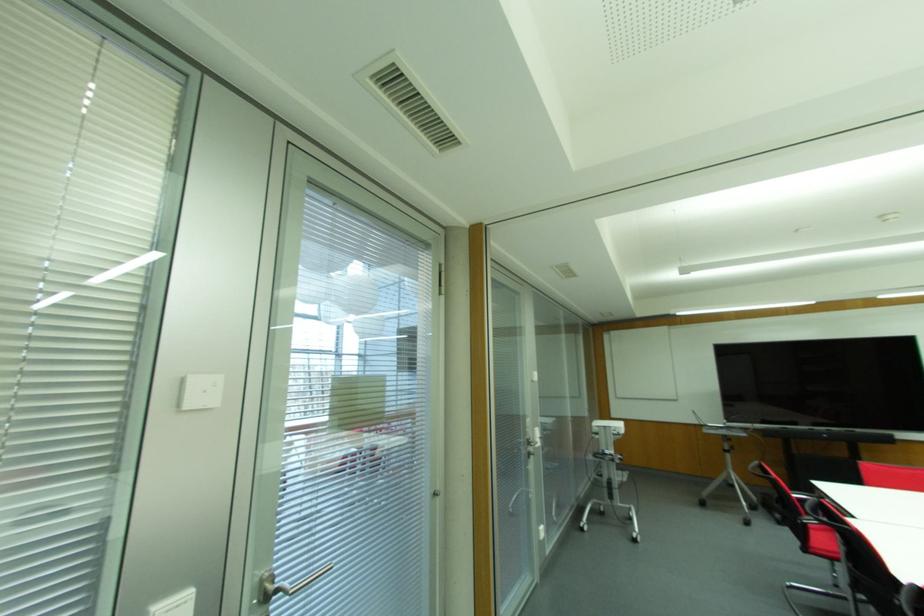
I want to click on red chair sitting surface, so click(822, 541).